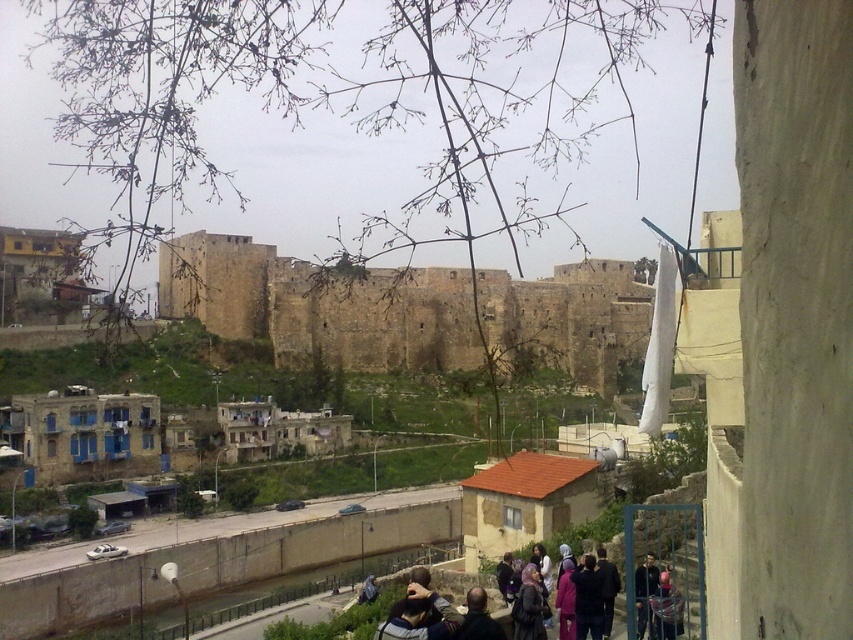
Can you confirm if brown stone fort at center is taller than dark blue jacket at lower right?

Yes, brown stone fort at center is taller than dark blue jacket at lower right.

Does brown stone fort at center have a lesser width compared to dark blue jacket at lower right?

In fact, brown stone fort at center might be wider than dark blue jacket at lower right.

Describe the element at coordinates (320, 307) in the screenshot. This screenshot has width=853, height=640. I see `brown stone fort at center` at that location.

In order to click on brown stone fort at center in this screenshot , I will do `click(320, 307)`.